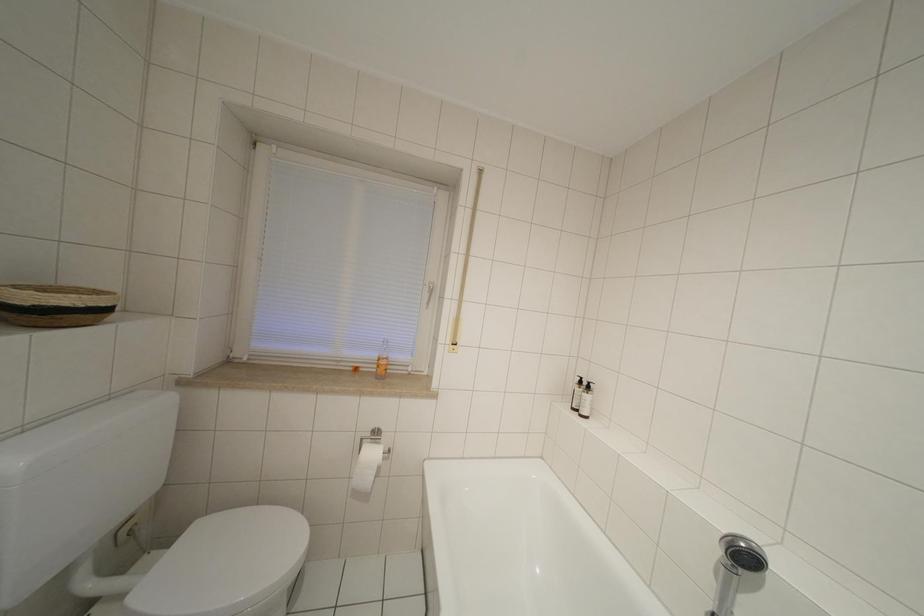
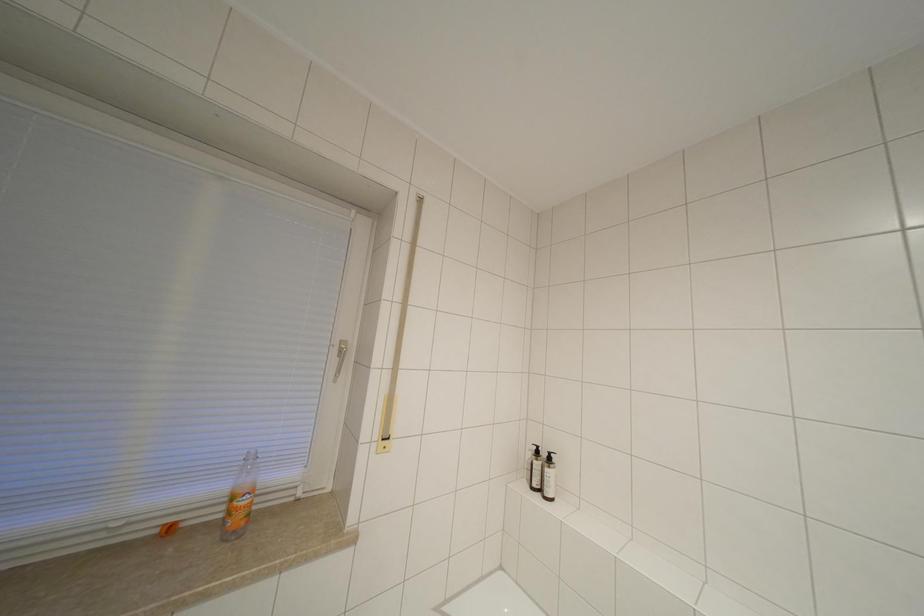
Question: The camera is either moving clockwise (left) or counter-clockwise (right) around the object. The first image is from the beginning of the video and the second image is from the end. Is the camera moving left or right when shooting the video?

Choices:
 (A) Left
 (B) Right

Answer: (A)